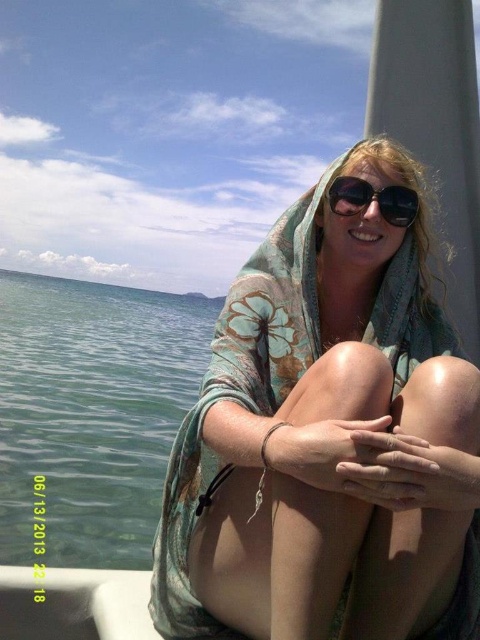
Is floral chiffon scarf at center in front of clear blue water at left?

That is True.

Find the location of a particular element. floral chiffon scarf at center is located at coordinates coord(324,436).

I want to click on floral chiffon scarf at center, so click(324, 436).

Which of these two, clear blue water at left or sunglasses at center, stands shorter?

sunglasses at center

Does clear blue water at left have a smaller size compared to sunglasses at center?

No.

Which is behind, point (183, 356) or point (354, 180)?

Positioned behind is point (183, 356).

I want to click on clear blue water at left, so click(x=91, y=413).

Does floral chiffon scarf at center appear on the left side of sunglasses at center?

Correct, you'll find floral chiffon scarf at center to the left of sunglasses at center.

Is point (466, 515) farther from viewer compared to point (407, 195)?

No.

The width and height of the screenshot is (480, 640). I want to click on floral chiffon scarf at center, so click(324, 436).